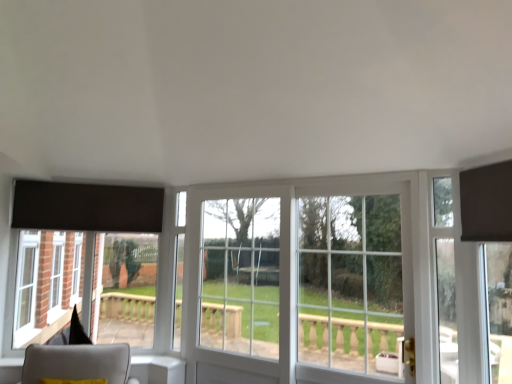
Question: From a real-world perspective, does matte black curtain at upper right sit lower than clear glass window at center?

Choices:
 (A) yes
 (B) no

Answer: (B)

Question: Is the surface of matte black curtain at upper right in direct contact with clear glass window at center?

Choices:
 (A) yes
 (B) no

Answer: (B)

Question: Does matte black curtain at upper right have a smaller size compared to clear glass window at center?

Choices:
 (A) no
 (B) yes

Answer: (B)

Question: Is matte black curtain at upper right at the right side of clear glass window at center?

Choices:
 (A) no
 (B) yes

Answer: (B)

Question: Is matte black curtain at upper right facing towards clear glass window at center?

Choices:
 (A) yes
 (B) no

Answer: (B)

Question: Does matte black curtain at upper right lie behind clear glass window at center?

Choices:
 (A) no
 (B) yes

Answer: (A)

Question: Is clear glass door at right aimed at clear glass door at center?

Choices:
 (A) yes
 (B) no

Answer: (B)

Question: Does clear glass door at right have a lesser width compared to clear glass door at center?

Choices:
 (A) no
 (B) yes

Answer: (A)

Question: Is the position of clear glass door at right more distant than that of clear glass door at center?

Choices:
 (A) no
 (B) yes

Answer: (A)

Question: Considering the relative sizes of clear glass door at right and clear glass door at center in the image provided, is clear glass door at right smaller than clear glass door at center?

Choices:
 (A) no
 (B) yes

Answer: (A)

Question: From a real-world perspective, is clear glass door at right on top of clear glass door at center?

Choices:
 (A) yes
 (B) no

Answer: (A)

Question: Is clear glass door at right to the left of clear glass door at center from the viewer's perspective?

Choices:
 (A) yes
 (B) no

Answer: (B)

Question: Does light gray fabric chair at lower left come behind matte black curtain at upper right?

Choices:
 (A) no
 (B) yes

Answer: (B)